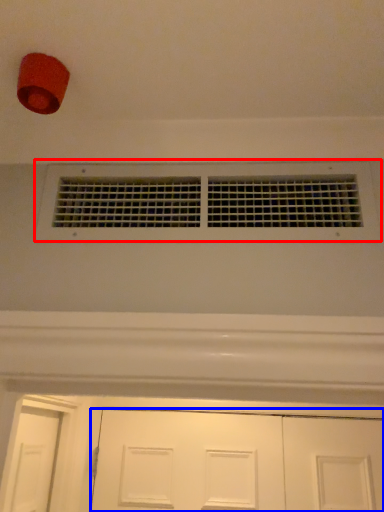
Question: Which object is further to the camera taking this photo, window (highlighted by a red box) or door (highlighted by a blue box)?

Choices:
 (A) window
 (B) door

Answer: (B)